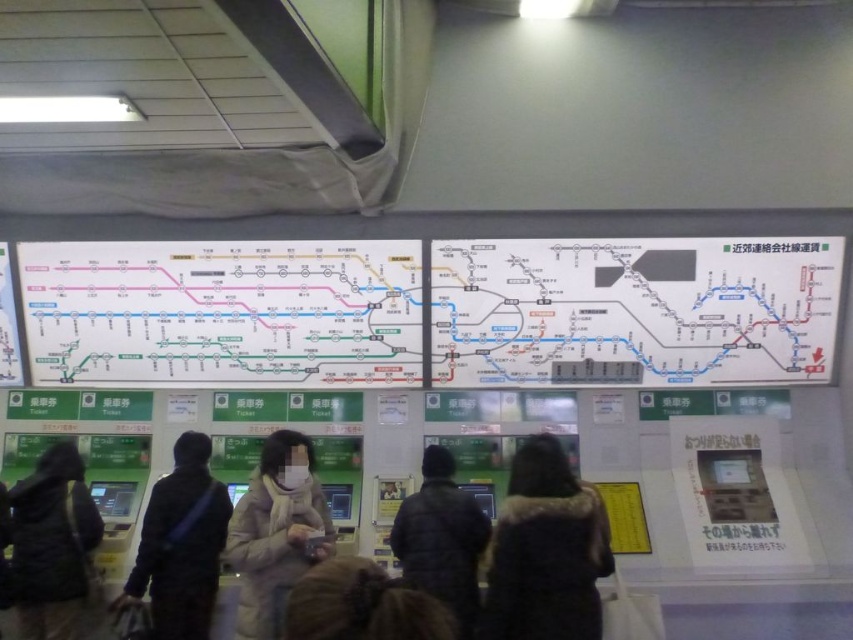
Question: Which point is farther to the camera?

Choices:
 (A) dark gray jacket at center
 (B) dark brown fur coat at center
 (C) dark gray jacket at lower left

Answer: (C)

Question: Does white paper map at center lie behind white puffy coat at center?

Choices:
 (A) no
 (B) yes

Answer: (B)

Question: Which point is closer to the camera taking this photo?

Choices:
 (A) (207, 476)
 (B) (509, 497)

Answer: (B)

Question: Can you confirm if dark brown fur coat at center is wider than black puffy coat at center?

Choices:
 (A) yes
 (B) no

Answer: (A)

Question: Among these points, which one is farthest from the camera?

Choices:
 (A) (71, 508)
 (B) (517, 604)
 (C) (321, 602)

Answer: (A)

Question: Is white paper map at center to the left of white puffy coat at center from the viewer's perspective?

Choices:
 (A) yes
 (B) no

Answer: (B)